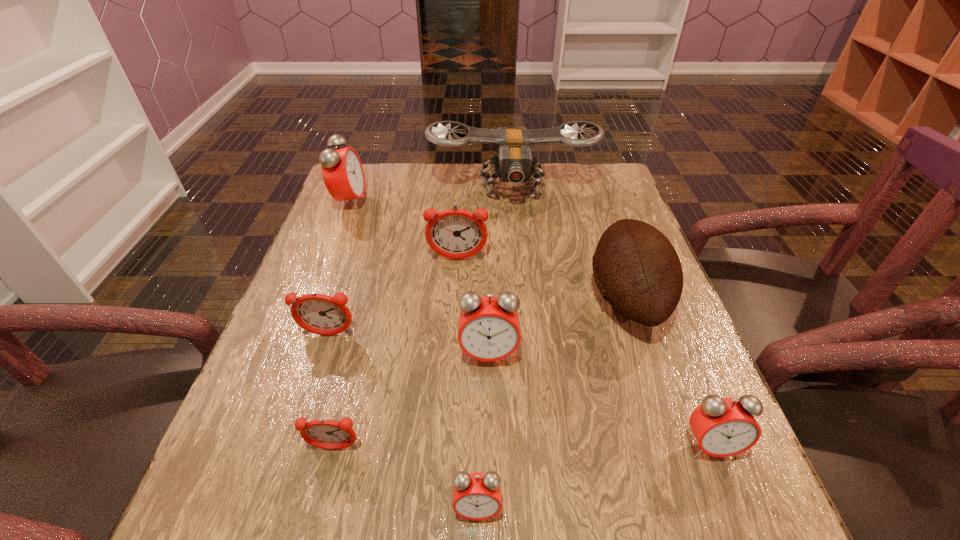
Find the location of a particular element. This screenshot has width=960, height=540. empty space that is in between the nearest reddish-pink alarm clock and the brown football is located at coordinates click(481, 373).

This screenshot has height=540, width=960. In order to click on vacant space that is in between the leftmost red alarm clock and the sixth nearest alarm clock in this screenshot , I will do `click(404, 231)`.

Image resolution: width=960 pixels, height=540 pixels. I want to click on free spot between the nearest reddish-pink alarm clock and the second smallest reddish-pink alarm clock, so click(x=331, y=392).

At what (x,y) coordinates should I click in order to perform the action: click on vacant area between the tallest alarm clock and the rightmost red alarm clock. Please return your answer as a coordinate pair (x, y). This screenshot has height=540, width=960. Looking at the image, I should click on (530, 323).

Locate an element on the screen. The image size is (960, 540). object that stands as the third closest to the drone is located at coordinates (636, 268).

Locate an element on the screen. The image size is (960, 540). object that is the sixth closest one to the yellow drone is located at coordinates (723, 427).

Where is `alarm clock that is the second closest to the nearest object`? The image size is (960, 540). alarm clock that is the second closest to the nearest object is located at coordinates (488, 329).

Where is `alarm clock that stands as the closest to the tallest alarm clock`? alarm clock that stands as the closest to the tallest alarm clock is located at coordinates (454, 233).

Find the location of a particular element. The width and height of the screenshot is (960, 540). the second closest red alarm clock to the rightmost red alarm clock is located at coordinates (476, 496).

Image resolution: width=960 pixels, height=540 pixels. I want to click on the second closest red alarm clock to the nearest reddish-pink alarm clock, so (x=488, y=329).